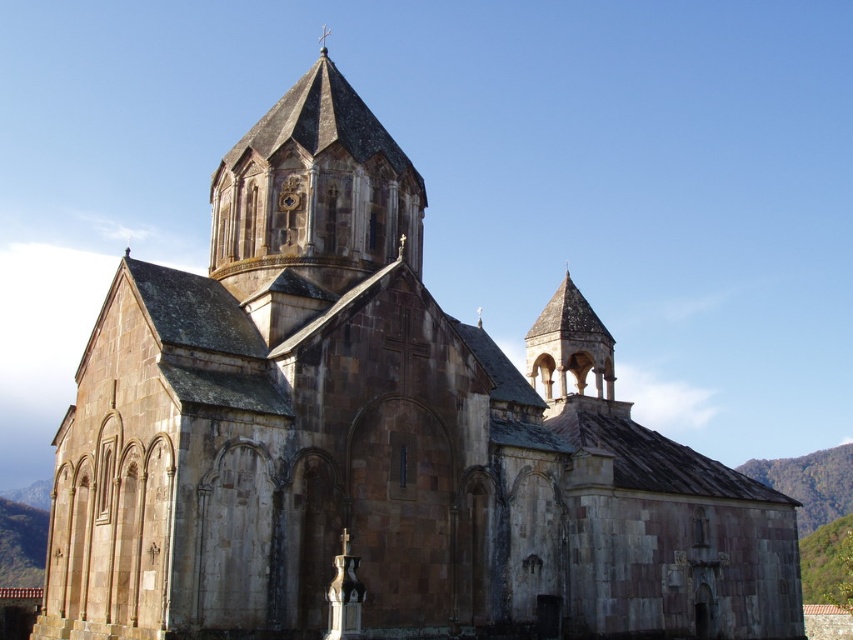
Question: Does brown stone tower at center lie behind smooth stone spire at upper center?

Choices:
 (A) yes
 (B) no

Answer: (B)

Question: Does brown stone tower at center have a larger size compared to smooth stone spire at upper center?

Choices:
 (A) yes
 (B) no

Answer: (B)

Question: Is brown stone tower at center thinner than smooth stone spire at upper center?

Choices:
 (A) no
 (B) yes

Answer: (B)

Question: Which object appears closest to the camera in this image?

Choices:
 (A) smooth stone spire at upper center
 (B) brown stone tower at center

Answer: (B)

Question: Which point appears closest to the camera in this image?

Choices:
 (A) (350, 196)
 (B) (326, 35)

Answer: (A)